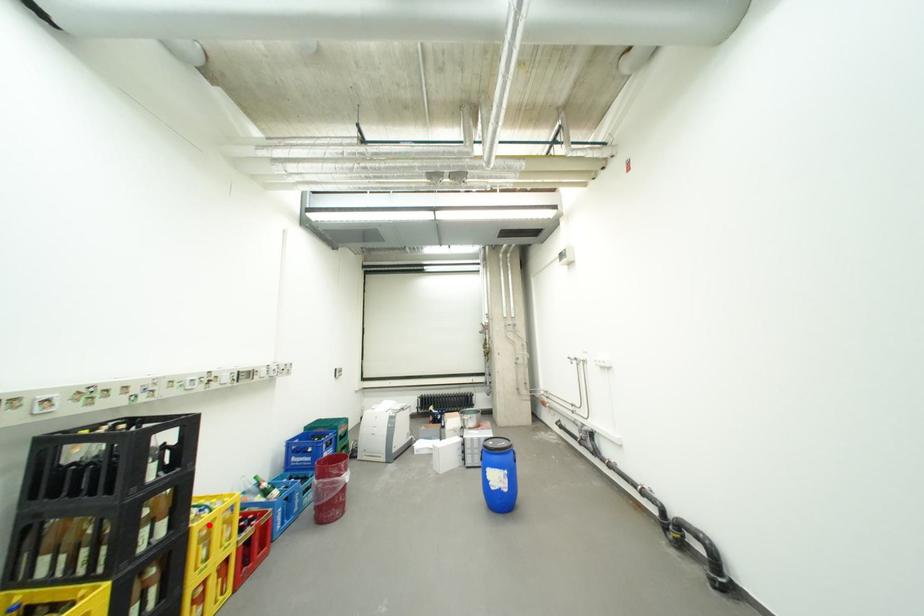
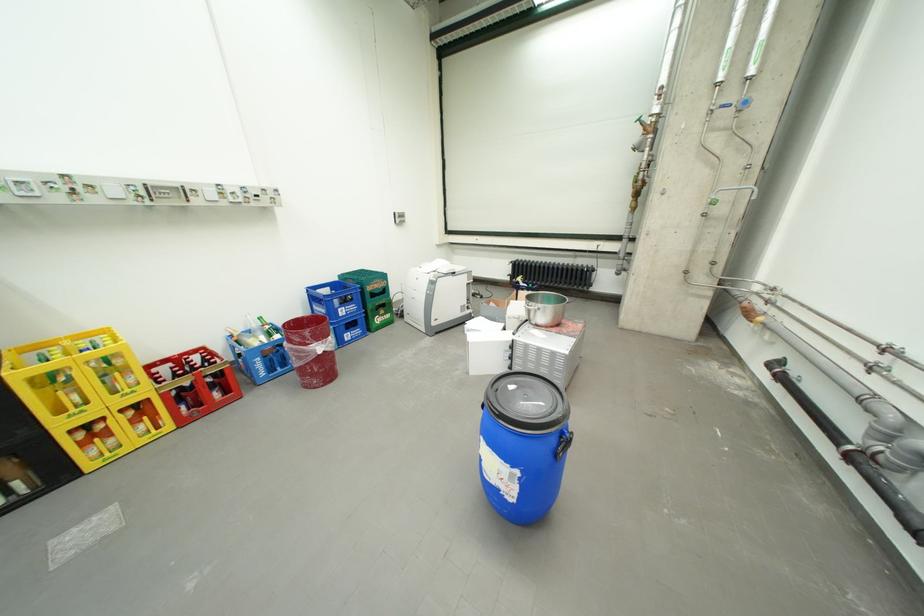
Locate, in the second image, the point that corresponds to the highlighted location in the first image.

(30, 374)